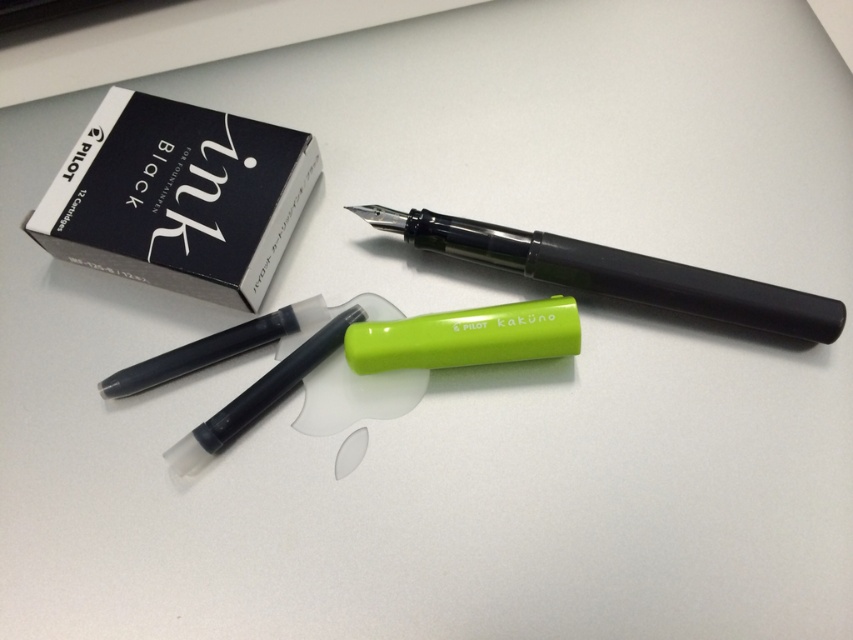
Can you confirm if black matte ink cartridge box at upper left is taller than matte black fountain pen at center?

Yes, black matte ink cartridge box at upper left is taller than matte black fountain pen at center.

The height and width of the screenshot is (640, 853). What do you see at coordinates (178, 196) in the screenshot?
I see `black matte ink cartridge box at upper left` at bounding box center [178, 196].

Is point (177, 145) positioned after point (550, 268)?

That is True.

Where is `black matte ink cartridge box at upper left`? The image size is (853, 640). black matte ink cartridge box at upper left is located at coordinates (178, 196).

Is black matte ink cartridge box at upper left to the left of white matte eraser at center from the viewer's perspective?

Indeed, black matte ink cartridge box at upper left is positioned on the left side of white matte eraser at center.

Which of these two, black matte ink cartridge box at upper left or white matte eraser at center, stands taller?

With more height is black matte ink cartridge box at upper left.

Who is more forward, (181, 285) or (339, 477)?

Point (339, 477) is in front.

In order to click on black matte ink cartridge box at upper left in this screenshot , I will do `click(178, 196)`.

Is matte black fountain pen at center further to the viewer compared to white matte eraser at center?

No, it is not.

Can you confirm if matte black fountain pen at center is positioned below white matte eraser at center?

No, matte black fountain pen at center is not below white matte eraser at center.

Is point (807, 298) in front of point (358, 458)?

Yes, it is.

The height and width of the screenshot is (640, 853). Identify the location of matte black fountain pen at center. (618, 273).